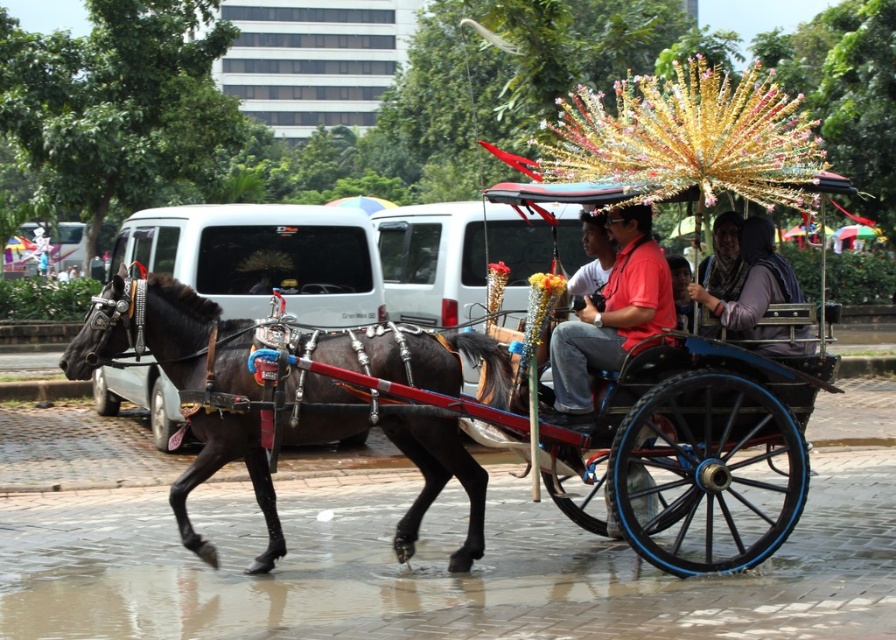
Question: Estimate the real-world distances between objects in this image. Which object is closer to the matte red shirt at center?

Choices:
 (A) matte purple scarf at center
 (B) shiny black horse at left

Answer: (A)

Question: Does shiny black horse at left lie in front of matte purple scarf at center?

Choices:
 (A) no
 (B) yes

Answer: (B)

Question: Which point is farther to the camera?

Choices:
 (A) (625, 211)
 (B) (366, 410)
 (C) (746, 294)

Answer: (C)

Question: Which point is closer to the camera?

Choices:
 (A) (173, 372)
 (B) (578, 401)

Answer: (B)

Question: Is matte red shirt at center thinner than matte purple scarf at center?

Choices:
 (A) yes
 (B) no

Answer: (A)

Question: Is shiny black horse at left further to camera compared to matte purple scarf at center?

Choices:
 (A) yes
 (B) no

Answer: (B)